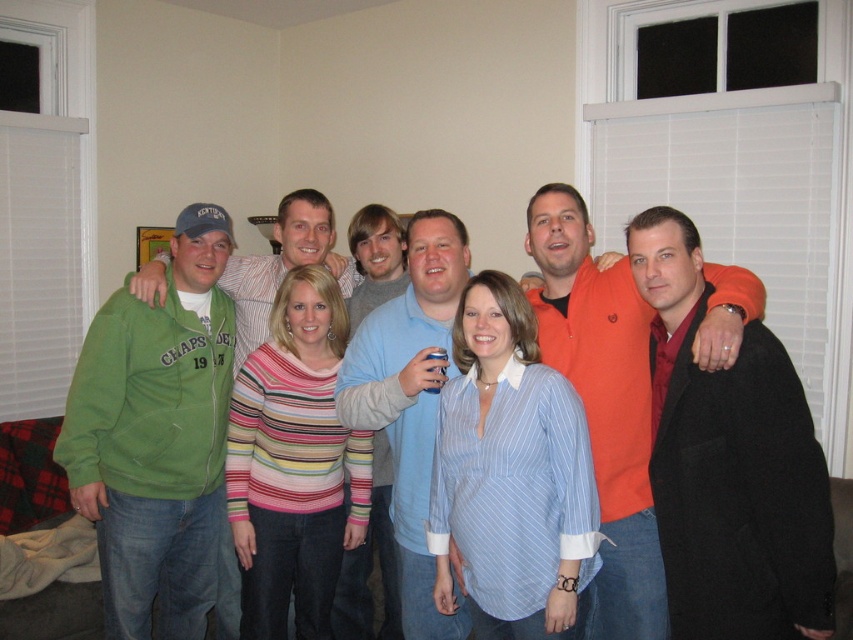
Question: Which is farther from the light blue cotton shirt at center?

Choices:
 (A) orange fleece sweater at center
 (B) striped knit sweater at center
 (C) blue striped shirt at center

Answer: (A)

Question: Does blue striped shirt at center appear under striped knit sweater at center?

Choices:
 (A) yes
 (B) no

Answer: (B)

Question: Estimate the real-world distances between objects in this image. Which object is closer to the striped knit sweater at center?

Choices:
 (A) light blue cotton shirt at center
 (B) orange fleece sweater at center

Answer: (A)

Question: Is orange fleece sweater at center closer to the viewer compared to light blue cotton shirt at center?

Choices:
 (A) yes
 (B) no

Answer: (A)

Question: Considering the real-world distances, which object is farthest from the striped knit sweater at center?

Choices:
 (A) blue striped shirt at center
 (B) light blue cotton shirt at center

Answer: (A)

Question: Does orange fleece sweater at center appear under light blue cotton shirt at center?

Choices:
 (A) yes
 (B) no

Answer: (B)